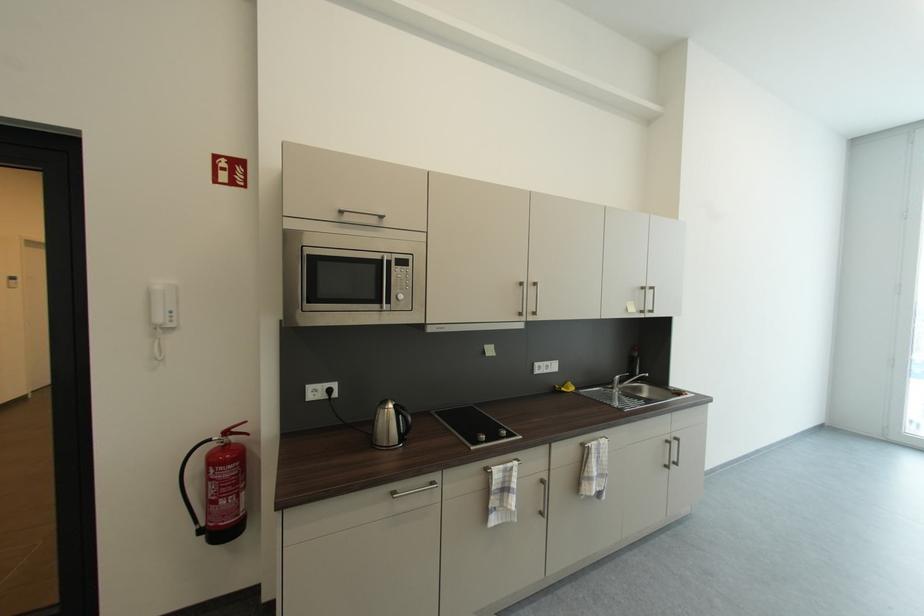
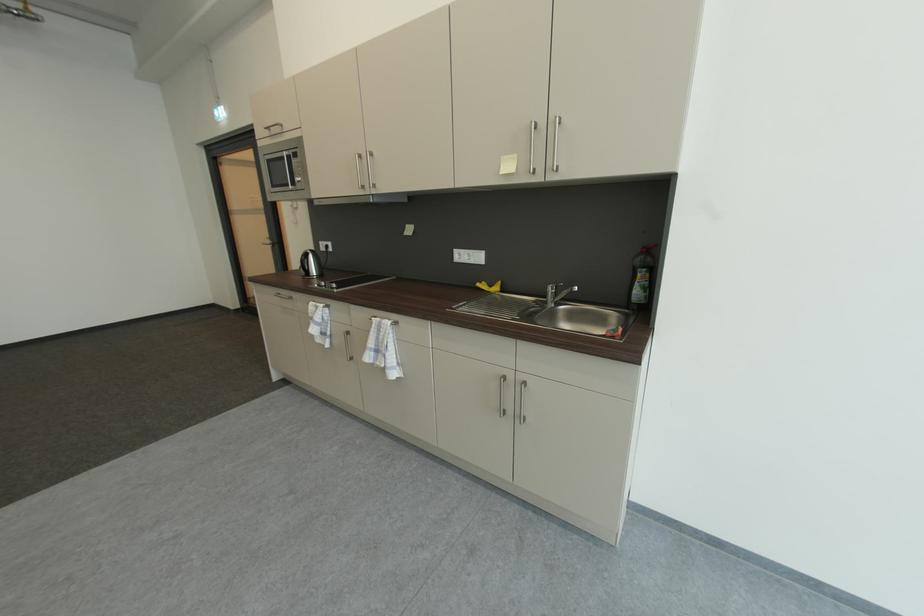
Find the pixel in the second image that matches the point at 554,371 in the first image.

(479, 262)